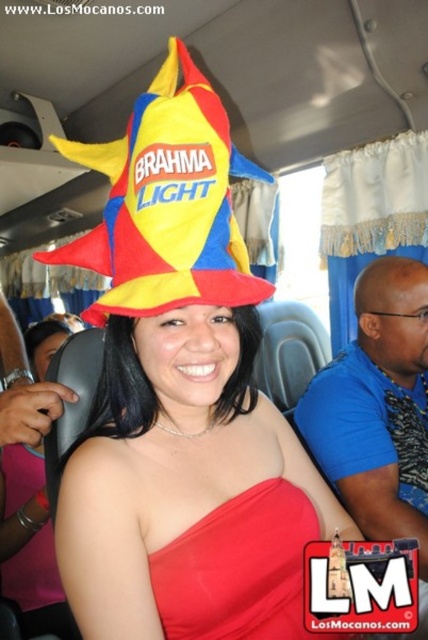
Is matte plastic hat at center shorter than blue fabric shirt at right?

Yes.

Between matte plastic hat at center and blue fabric shirt at right, which one has more height?

Result: blue fabric shirt at right is taller.

Between point (219, 516) and point (425, 285), which one is positioned in front?

Point (219, 516) is more forward.

Locate an element on the screen. This screenshot has width=428, height=640. matte plastic hat at center is located at coordinates (187, 490).

Who is more forward, [409,516] or [196,547]?

Point [196,547] is in front.

Is point (382, 532) less distant than point (284, 480)?

No, it is behind (284, 480).

Who is more distant from viewer, (x=416, y=513) or (x=276, y=528)?

Point (x=416, y=513)

Where is `blue fabric shirt at right`? This screenshot has height=640, width=428. blue fabric shirt at right is located at coordinates (379, 412).

Who is more forward, (127, 173) or (383, 342)?

Positioned in front is point (127, 173).

Is point (89, 164) behind point (359, 448)?

No, (89, 164) is closer to viewer.

Describe the element at coordinates (166, 204) in the screenshot. I see `polyester flag at center` at that location.

This screenshot has width=428, height=640. I want to click on polyester flag at center, so click(x=166, y=204).